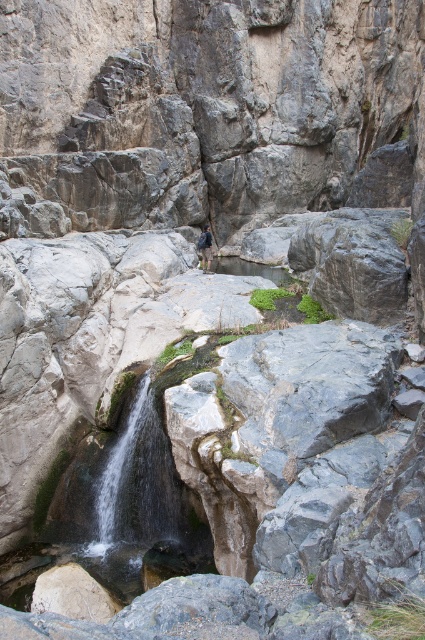
You are a hiker who wants to place your dark blue backpack at center on the ground near the green mossy rock at center. Can you put it to the right of the rock?

Yes, you can place the dark blue backpack at center to the right of the green mossy rock at center because the green mossy rock at center is currently on the left side of the backpack.

You are a hiker who wants to place your dark blue backpack at center on a stable surface. Based on the scene, can you confirm if the green mossy rock at center is a suitable place to put your backpack?

The green mossy rock at center is located below dark blue backpack at center, which suggests the backpack is already placed on a higher surface, so the rock might not be the current location of the backpack. Check another stable surface nearby.